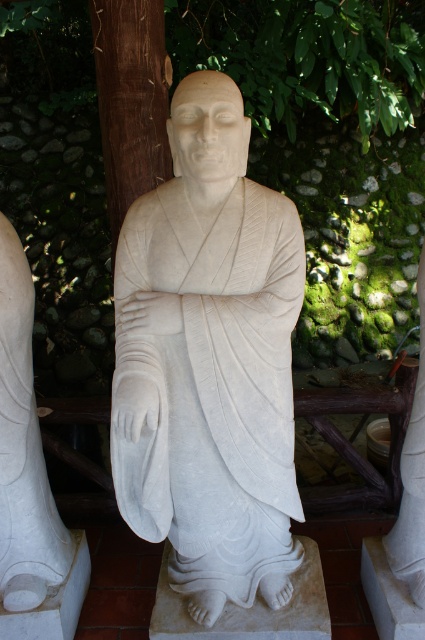
Question: Which of the following is the farthest from the observer?

Choices:
 (A) white marble statue at center
 (B) white marble statue at lower left

Answer: (B)

Question: Where is white marble statue at center located in relation to white marble statue at lower left in the image?

Choices:
 (A) below
 (B) above

Answer: (B)

Question: Is white marble statue at center above white marble statue at lower left?

Choices:
 (A) yes
 (B) no

Answer: (A)

Question: Does white marble statue at center lie behind white marble statue at lower left?

Choices:
 (A) no
 (B) yes

Answer: (A)

Question: Which point is closer to the camera?

Choices:
 (A) (5, 364)
 (B) (257, 218)

Answer: (B)